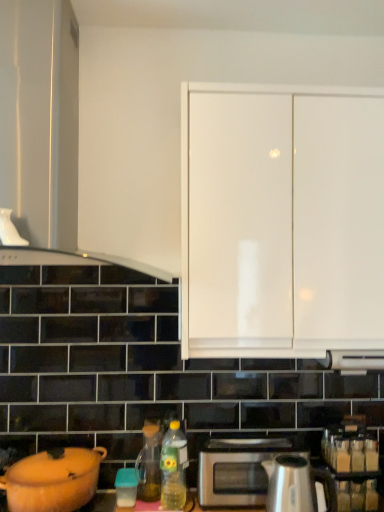
Question: From a real-world perspective, is matte orange pot at lower left, the second kitchen appliance in the right-to-left sequence, positioned above or below matte glass tea pot at lower center?

Choices:
 (A) below
 (B) above

Answer: (A)

Question: From the image's perspective, is matte orange pot at lower left, the second kitchen appliance in the right-to-left sequence, located above or below matte glass tea pot at lower center?

Choices:
 (A) below
 (B) above

Answer: (B)

Question: Based on their relative distances, which object is nearer to the matte orange pot at lower left, the second kitchen appliance in the right-to-left sequence?

Choices:
 (A) white glossy cabinet doors at upper center, acting as the second cabinetry starting from the left
 (B) matte glass tea pot at lower center
 (C) polished stainless steel kettle at lower center, which appears as the first kitchen appliance when viewed from the right
 (D) green plastic bottle at lower center
 (E) white glossy cabinet at upper left, which is the 1th cabinetry from left to right

Answer: (B)

Question: Which of these objects is positioned farthest from the matte glass tea pot at lower center?

Choices:
 (A) polished stainless steel kettle at lower center, arranged as the second kitchen appliance when viewed from the left
 (B) matte orange pot at lower left, the second kitchen appliance in the right-to-left sequence
 (C) white glossy cabinet at upper left, which appears as the second cabinetry when viewed from the right
 (D) green plastic bottle at lower center
 (E) satin silver microwave at lower center

Answer: (C)